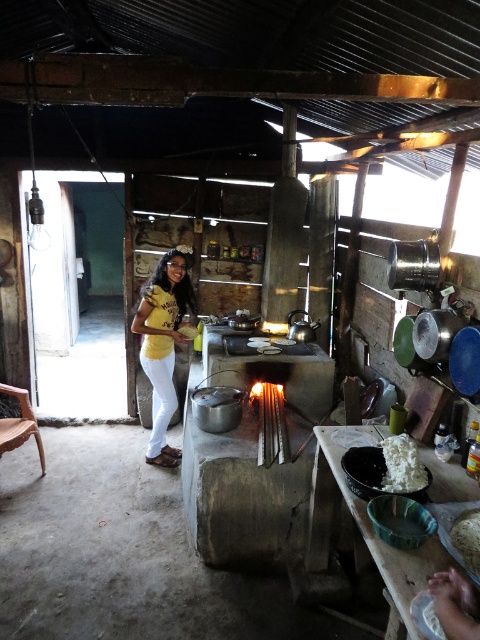
You are a guest in this rustic kitchen and notice the yellow matte shirt at center and the white fluffy rice at lower right. From your perspective, which item is positioned higher?

The yellow matte shirt at center is above the white fluffy rice at lower right, so it is positioned higher.

You are standing in the rustic kitchen and need to locate the yellow matte shirt at center. According to the coordinates provided, where exactly would you find it in the image?

The yellow matte shirt at center is located at the coordinates point (x=163, y=344) in the image.